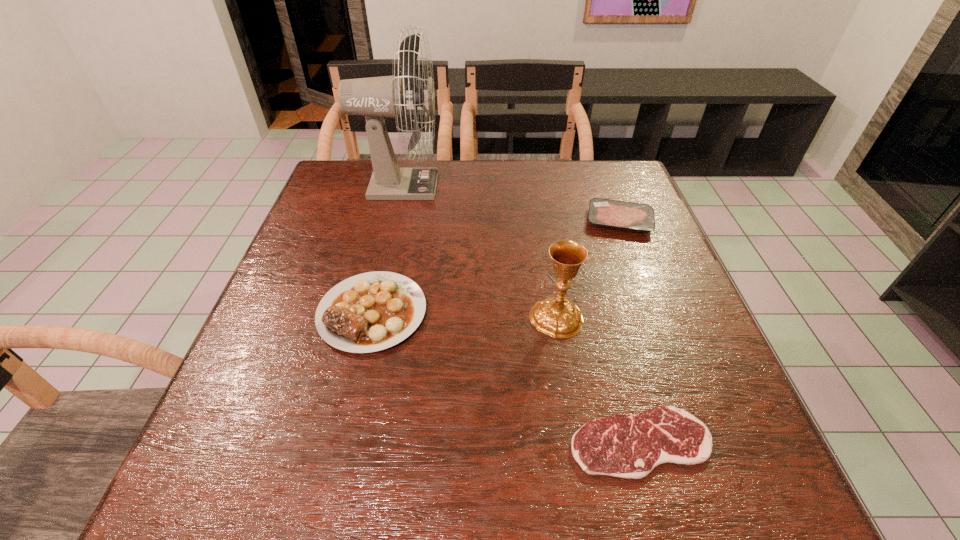
Where is `vacant space at the left edge of the desktop`? vacant space at the left edge of the desktop is located at coordinates (347, 213).

Identify the location of vacant space at the right edge of the desktop. (636, 343).

Where is `free space at the near right corner`? This screenshot has width=960, height=540. free space at the near right corner is located at coordinates (768, 494).

Locate an element on the screen. The width and height of the screenshot is (960, 540). vacant space that is in between the shortest object and the second farthest steak is located at coordinates (507, 377).

Where is `vacant area between the fan and the chalice`? The height and width of the screenshot is (540, 960). vacant area between the fan and the chalice is located at coordinates (478, 252).

Image resolution: width=960 pixels, height=540 pixels. Find the location of `vacant point located between the second shortest object and the second farthest steak`. vacant point located between the second shortest object and the second farthest steak is located at coordinates (496, 267).

Identify the location of empty location between the fourth tallest object and the leftmost steak. (496, 267).

Locate an element on the screen. This screenshot has width=960, height=540. vacant area that lies between the nearest object and the leftmost steak is located at coordinates (507, 377).

Locate an element on the screen. free area in between the nearest steak and the second tallest object is located at coordinates (598, 380).

Locate an element on the screen. The height and width of the screenshot is (540, 960). vacant space that's between the fan and the farthest steak is located at coordinates (510, 204).